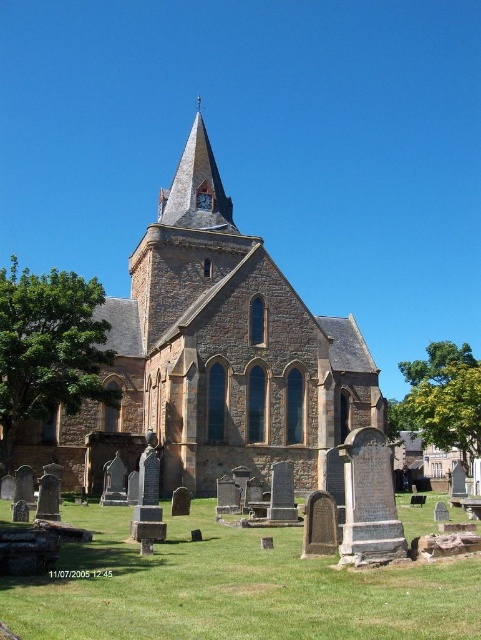
Question: Does brown stone church at center have a larger size compared to smooth stone spire at upper center?

Choices:
 (A) yes
 (B) no

Answer: (B)

Question: Does brown stone church at center appear on the left side of smooth stone spire at upper center?

Choices:
 (A) no
 (B) yes

Answer: (A)

Question: Among these points, which one is farthest from the camera?

Choices:
 (A) (202, 205)
 (B) (323, 340)

Answer: (A)

Question: Can you confirm if brown stone church at center is wider than smooth stone spire at upper center?

Choices:
 (A) no
 (B) yes

Answer: (B)

Question: Which point is closer to the camera taking this photo?

Choices:
 (A) (202, 208)
 (B) (265, 307)

Answer: (B)